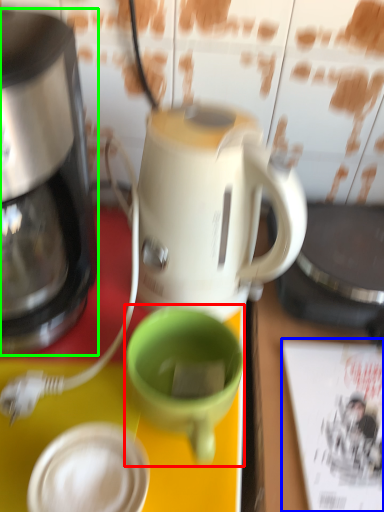
Question: Which is nearer to the coffee cup (highlighted by a red box)? magazine (highlighted by a blue box) or coffee maker (highlighted by a green box).

Choices:
 (A) magazine
 (B) coffee maker

Answer: (A)